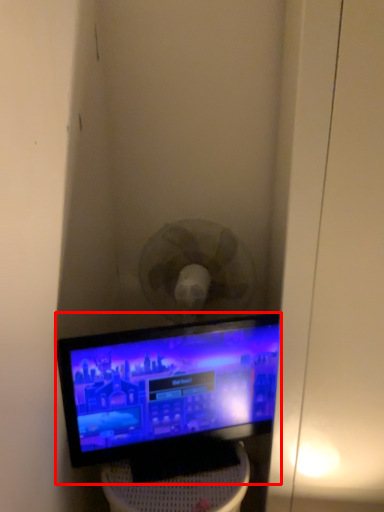
Question: From the image, what is the correct spatial relationship of computer monitor (annotated by the red box) in relation to furniture?

Choices:
 (A) right
 (B) left

Answer: (A)